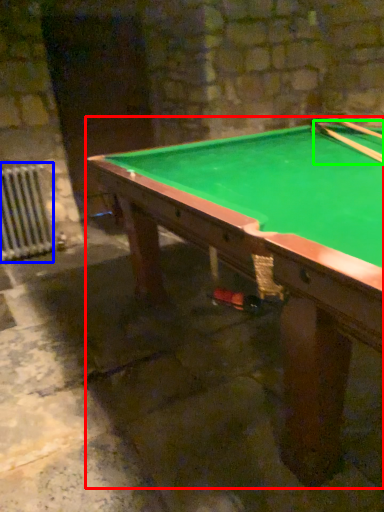
Question: Based on their relative distances, which object is farther from billiard table (highlighted by a red box)? Choose from radiator (highlighted by a blue box) and cue (highlighted by a green box).

Choices:
 (A) radiator
 (B) cue

Answer: (A)